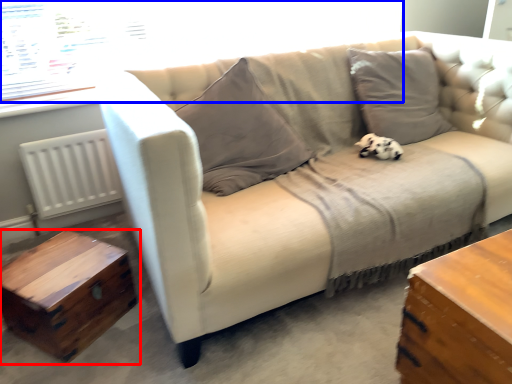
Question: Among these objects, which one is nearest to the camera, table (highlighted by a red box) or window screen (highlighted by a blue box)?

Choices:
 (A) table
 (B) window screen

Answer: (A)